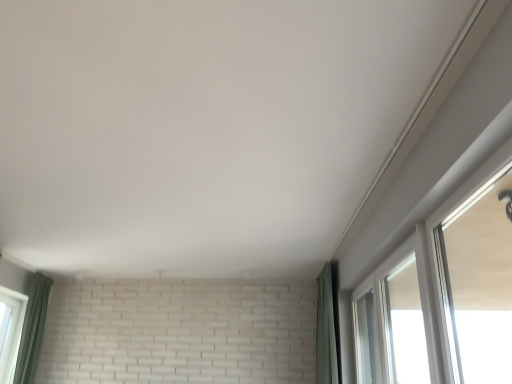
This screenshot has height=384, width=512. Describe the element at coordinates (404, 324) in the screenshot. I see `transparent glass window at upper right, the first window in the back-to-front sequence` at that location.

Locate an element on the screen. The image size is (512, 384). transparent glass window at upper right, positioned as the 2th window in front-to-back order is located at coordinates (404, 324).

Is green fabric curtain at right, the first curtain when ordered from right to left, bigger or smaller than white glossy window at upper right, placed as the 1th window when sorted from front to back?

green fabric curtain at right, the first curtain when ordered from right to left, is bigger than white glossy window at upper right, placed as the 1th window when sorted from front to back.

How many degrees apart are the facing directions of green fabric curtain at right, the first curtain when ordered from right to left, and white glossy window at upper right, positioned as the second window in back-to-front order?

The angle between the facing direction of green fabric curtain at right, the first curtain when ordered from right to left, and the facing direction of white glossy window at upper right, positioned as the second window in back-to-front order, is 0.236 degrees.

From the image's perspective, between green fabric curtain at right, the first curtain when ordered from right to left, and white glossy window at upper right, placed as the 1th window when sorted from front to back, which one is located above?

white glossy window at upper right, placed as the 1th window when sorted from front to back.

From a real-world perspective, is green fabric curtain at right, positioned as the 2th curtain in left-to-right order, located beneath white glossy window at upper right, positioned as the second window in back-to-front order?

No.

Are transparent glass window at upper right, positioned as the 2th window in front-to-back order, and green fabric curtain at right, positioned as the 2th curtain in left-to-right order, located far from each other?

They are positioned close to each other.

Is transparent glass window at upper right, positioned as the 2th window in front-to-back order, closer to camera compared to green fabric curtain at right, positioned as the 2th curtain in left-to-right order?

Yes, transparent glass window at upper right, positioned as the 2th window in front-to-back order, is in front of green fabric curtain at right, positioned as the 2th curtain in left-to-right order.

From the image's perspective, is transparent glass window at upper right, the first window in the back-to-front sequence, below green fabric curtain at right, the first curtain when ordered from right to left?

No, from the image's perspective, transparent glass window at upper right, the first window in the back-to-front sequence, is not beneath green fabric curtain at right, the first curtain when ordered from right to left.

From the picture: Considering the relative positions of green fabric curtain at lower left, which is the second curtain in right-to-left order, and transparent glass window at upper right, positioned as the 2th window in front-to-back order, in the image provided, is green fabric curtain at lower left, which is the second curtain in right-to-left order, to the left of transparent glass window at upper right, positioned as the 2th window in front-to-back order, from the viewer's perspective?

Yes, green fabric curtain at lower left, which is the second curtain in right-to-left order, is to the left of transparent glass window at upper right, positioned as the 2th window in front-to-back order.

Starting from the transparent glass window at upper right, positioned as the 2th window in front-to-back order, which curtain is the 2nd one to the left? Please provide its 2D coordinates.

[(32, 329)]

Would you say green fabric curtain at lower left, placed as the 1th curtain when sorted from left to right, is inside or outside transparent glass window at upper right, positioned as the 2th window in front-to-back order?

green fabric curtain at lower left, placed as the 1th curtain when sorted from left to right, cannot be found inside transparent glass window at upper right, positioned as the 2th window in front-to-back order.

What's the angular difference between green fabric curtain at lower left, placed as the 1th curtain when sorted from left to right, and transparent glass window at upper right, positioned as the 2th window in front-to-back order,'s facing directions?

The facing directions of green fabric curtain at lower left, placed as the 1th curtain when sorted from left to right, and transparent glass window at upper right, positioned as the 2th window in front-to-back order, are 180 degrees apart.

What's the angular difference between green fabric curtain at lower left, which is the second curtain in right-to-left order, and white glossy window at upper right, placed as the 1th window when sorted from front to back,'s facing directions?

The facing directions of green fabric curtain at lower left, which is the second curtain in right-to-left order, and white glossy window at upper right, placed as the 1th window when sorted from front to back, are 180 degrees apart.

Which is behind, point (45, 287) or point (418, 319)?

The point (45, 287) is behind.

Which of these two, green fabric curtain at lower left, placed as the 1th curtain when sorted from left to right, or white glossy window at upper right, placed as the 1th window when sorted from front to back, is bigger?

white glossy window at upper right, placed as the 1th window when sorted from front to back, is bigger.

Is green fabric curtain at lower left, placed as the 1th curtain when sorted from left to right, positioned with its back to white glossy window at upper right, placed as the 1th window when sorted from front to back?

No, green fabric curtain at lower left, placed as the 1th curtain when sorted from left to right,'s orientation is not away from white glossy window at upper right, placed as the 1th window when sorted from front to back.

From a real-world perspective, who is located lower, white glossy window at upper right, positioned as the second window in back-to-front order, or transparent glass window at upper right, positioned as the 2th window in front-to-back order?

transparent glass window at upper right, positioned as the 2th window in front-to-back order, is physically lower.

Is transparent glass window at upper right, the first window in the back-to-front sequence, a part of white glossy window at upper right, placed as the 1th window when sorted from front to back?

Yes, white glossy window at upper right, placed as the 1th window when sorted from front to back, contains transparent glass window at upper right, the first window in the back-to-front sequence.

Identify the location of window lying in front of the transparent glass window at upper right, the first window in the back-to-front sequence. Image resolution: width=512 pixels, height=384 pixels. (404, 316).

How distant is white glossy window at upper right, placed as the 1th window when sorted from front to back, from transparent glass window at upper right, positioned as the 2th window in front-to-back order?

white glossy window at upper right, placed as the 1th window when sorted from front to back, and transparent glass window at upper right, positioned as the 2th window in front-to-back order, are 66.63 centimeters apart.

Who is smaller, transparent glass window at upper right, positioned as the 2th window in front-to-back order, or white glossy window at upper right, positioned as the second window in back-to-front order?

With smaller size is transparent glass window at upper right, positioned as the 2th window in front-to-back order.

From a real-world perspective, is transparent glass window at upper right, positioned as the 2th window in front-to-back order, on top of white glossy window at upper right, positioned as the second window in back-to-front order?

No.

Is transparent glass window at upper right, positioned as the 2th window in front-to-back order, closer to the viewer compared to white glossy window at upper right, positioned as the second window in back-to-front order?

No, the depth of transparent glass window at upper right, positioned as the 2th window in front-to-back order, is greater than that of white glossy window at upper right, positioned as the second window in back-to-front order.

Can you confirm if transparent glass window at upper right, the first window in the back-to-front sequence, is positioned to the left of white glossy window at upper right, placed as the 1th window when sorted from front to back?

No.

Can we say green fabric curtain at lower left, placed as the 1th curtain when sorted from left to right, lies outside green fabric curtain at right, positioned as the 2th curtain in left-to-right order?

That's correct, green fabric curtain at lower left, placed as the 1th curtain when sorted from left to right, is outside of green fabric curtain at right, positioned as the 2th curtain in left-to-right order.

Are green fabric curtain at lower left, placed as the 1th curtain when sorted from left to right, and green fabric curtain at right, the first curtain when ordered from right to left, far apart?

Absolutely, green fabric curtain at lower left, placed as the 1th curtain when sorted from left to right, is distant from green fabric curtain at right, the first curtain when ordered from right to left.

Is green fabric curtain at lower left, placed as the 1th curtain when sorted from left to right, positioned before green fabric curtain at right, positioned as the 2th curtain in left-to-right order?

No, it is behind green fabric curtain at right, positioned as the 2th curtain in left-to-right order.

In the scene shown: Does green fabric curtain at lower left, which is the second curtain in right-to-left order, turn towards green fabric curtain at right, positioned as the 2th curtain in left-to-right order?

Yes, green fabric curtain at lower left, which is the second curtain in right-to-left order, is turned towards green fabric curtain at right, positioned as the 2th curtain in left-to-right order.

Identify the location of curtain that is the 1st object to the left of the white glossy window at upper right, positioned as the second window in back-to-front order, starting at the anchor. The height and width of the screenshot is (384, 512). (328, 327).

You are a GUI agent. You are given a task and a screenshot of the screen. Output one action in this format:
    pyautogui.click(x=<x>, y=<y>)
    Task: Click on the window that is the 2nd object to the right of the green fabric curtain at right, positioned as the 2th curtain in left-to-right order, starting at the anchor
    Image resolution: width=512 pixels, height=384 pixels.
    Given the screenshot: What is the action you would take?
    pyautogui.click(x=404, y=324)

Looking at the image, which one is located closer to green fabric curtain at right, positioned as the 2th curtain in left-to-right order, green fabric curtain at lower left, placed as the 1th curtain when sorted from left to right, or transparent glass window at upper right, the first window in the back-to-front sequence?

transparent glass window at upper right, the first window in the back-to-front sequence, is closer to green fabric curtain at right, positioned as the 2th curtain in left-to-right order.

Considering their positions, is transparent glass window at upper right, positioned as the 2th window in front-to-back order, positioned closer to white glossy window at upper right, positioned as the second window in back-to-front order, than green fabric curtain at lower left, which is the second curtain in right-to-left order?

The object closer to white glossy window at upper right, positioned as the second window in back-to-front order, is transparent glass window at upper right, positioned as the 2th window in front-to-back order.

Considering their positions, is green fabric curtain at lower left, placed as the 1th curtain when sorted from left to right, positioned further to white glossy window at upper right, placed as the 1th window when sorted from front to back, than transparent glass window at upper right, positioned as the 2th window in front-to-back order?

Based on the image, green fabric curtain at lower left, placed as the 1th curtain when sorted from left to right, appears to be further to white glossy window at upper right, placed as the 1th window when sorted from front to back.

Considering their positions, is white glossy window at upper right, positioned as the second window in back-to-front order, positioned further to green fabric curtain at right, the first curtain when ordered from right to left, than green fabric curtain at lower left, placed as the 1th curtain when sorted from left to right?

The object further to green fabric curtain at right, the first curtain when ordered from right to left, is green fabric curtain at lower left, placed as the 1th curtain when sorted from left to right.

From the picture: Looking at the image, which one is located closer to transparent glass window at upper right, the first window in the back-to-front sequence, green fabric curtain at lower left, placed as the 1th curtain when sorted from left to right, or white glossy window at upper right, placed as the 1th window when sorted from front to back?

white glossy window at upper right, placed as the 1th window when sorted from front to back, is positioned closer to the anchor transparent glass window at upper right, the first window in the back-to-front sequence.

Based on their spatial positions, is white glossy window at upper right, placed as the 1th window when sorted from front to back, or transparent glass window at upper right, the first window in the back-to-front sequence, closer to green fabric curtain at right, the first curtain when ordered from right to left?

Among the two, white glossy window at upper right, placed as the 1th window when sorted from front to back, is located nearer to green fabric curtain at right, the first curtain when ordered from right to left.

Looking at the image, which one is located closer to green fabric curtain at right, the first curtain when ordered from right to left, transparent glass window at upper right, the first window in the back-to-front sequence, or green fabric curtain at lower left, placed as the 1th curtain when sorted from left to right?

transparent glass window at upper right, the first window in the back-to-front sequence, lies closer to green fabric curtain at right, the first curtain when ordered from right to left, than the other object.

Which object lies nearer to the anchor point green fabric curtain at lower left, which is the second curtain in right-to-left order, white glossy window at upper right, placed as the 1th window when sorted from front to back, or green fabric curtain at right, the first curtain when ordered from right to left?

green fabric curtain at right, the first curtain when ordered from right to left, is positioned closer to the anchor green fabric curtain at lower left, which is the second curtain in right-to-left order.

Locate an element on the screen. The image size is (512, 384). window between white glossy window at upper right, placed as the 1th window when sorted from front to back, and green fabric curtain at right, the first curtain when ordered from right to left, from front to back is located at coordinates (404, 324).

Identify the location of curtain situated between green fabric curtain at lower left, which is the second curtain in right-to-left order, and transparent glass window at upper right, the first window in the back-to-front sequence, from left to right. This screenshot has width=512, height=384. (328, 327).

The width and height of the screenshot is (512, 384). I want to click on window between green fabric curtain at lower left, placed as the 1th curtain when sorted from left to right, and transparent glass window at upper right, positioned as the 2th window in front-to-back order, in the horizontal direction, so click(x=404, y=316).

This screenshot has height=384, width=512. Identify the location of curtain situated between green fabric curtain at lower left, which is the second curtain in right-to-left order, and white glossy window at upper right, placed as the 1th window when sorted from front to back, from left to right. (328, 327).